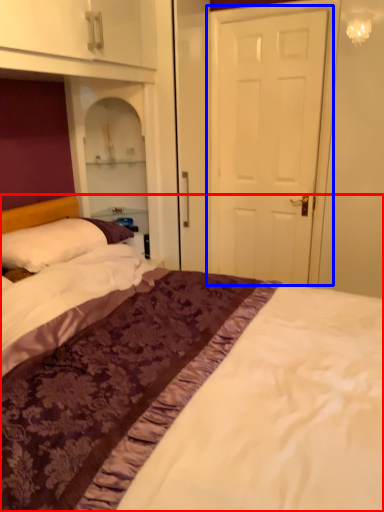
Question: Which object appears closest to the camera in this image, bed (highlighted by a red box) or door (highlighted by a blue box)?

Choices:
 (A) bed
 (B) door

Answer: (A)